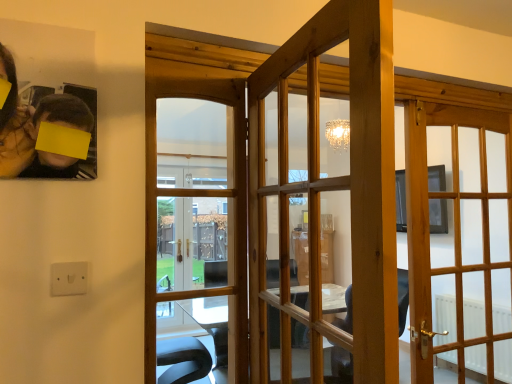
Question: Can you see light wood door at right, placed as the 1th door when sorted from back to front, touching green matte plant at upper left?

Choices:
 (A) yes
 (B) no

Answer: (B)

Question: Considering the relative sizes of light wood door at right, which is the third door in left-to-right order, and green matte plant at upper left in the image provided, is light wood door at right, which is the third door in left-to-right order, bigger than green matte plant at upper left?

Choices:
 (A) no
 (B) yes

Answer: (B)

Question: Considering the relative positions of light wood door at right, which ranks as the 3th door in front-to-back order, and green matte plant at upper left in the image provided, is light wood door at right, which ranks as the 3th door in front-to-back order, to the left of green matte plant at upper left from the viewer's perspective?

Choices:
 (A) no
 (B) yes

Answer: (A)

Question: Is light wood door at right, acting as the 1th door starting from the right, not close to green matte plant at upper left?

Choices:
 (A) yes
 (B) no

Answer: (A)

Question: Considering the relative sizes of light wood door at right, placed as the 1th door when sorted from back to front, and green matte plant at upper left in the image provided, is light wood door at right, placed as the 1th door when sorted from back to front, taller than green matte plant at upper left?

Choices:
 (A) yes
 (B) no

Answer: (A)

Question: In terms of width, does wooden glass door at center, which appears as the third door when viewed from the back, look wider or thinner when compared to white plastic electric outlet at lower left?

Choices:
 (A) thin
 (B) wide

Answer: (B)

Question: In terms of height, does wooden glass door at center, acting as the second door starting from the right, look taller or shorter compared to white plastic electric outlet at lower left?

Choices:
 (A) tall
 (B) short

Answer: (A)

Question: Which is correct: wooden glass door at center, which appears as the third door when viewed from the back, is inside white plastic electric outlet at lower left, or outside of it?

Choices:
 (A) outside
 (B) inside

Answer: (A)

Question: Is point (301, 309) positioned closer to the camera than point (56, 289)?

Choices:
 (A) closer
 (B) farther

Answer: (B)

Question: Considering the positions of white plastic electric outlet at lower left and wooden glass door at center, which appears as the 3th door when viewed from the right, in the image, is white plastic electric outlet at lower left bigger or smaller than wooden glass door at center, which appears as the 3th door when viewed from the right,?

Choices:
 (A) small
 (B) big

Answer: (A)

Question: From a real-world perspective, is white plastic electric outlet at lower left above or below wooden glass door at center, the 2th door from the front?

Choices:
 (A) below
 (B) above

Answer: (A)

Question: Would you say white plastic electric outlet at lower left is to the left or to the right of wooden glass door at center, arranged as the 1th door when viewed from the left, in the picture?

Choices:
 (A) right
 (B) left

Answer: (B)

Question: Is point (61, 276) positioned closer to the camera than point (245, 284)?

Choices:
 (A) farther
 (B) closer

Answer: (B)

Question: Considering their positions, is wooden glass door at center, which appears as the third door when viewed from the back, located in front of or behind wooden glass door at center, the 2th door from the front?

Choices:
 (A) front
 (B) behind

Answer: (A)

Question: Would you say wooden glass door at center, acting as the second door starting from the right, is inside or outside wooden glass door at center, which appears as the 3th door when viewed from the right?

Choices:
 (A) outside
 (B) inside

Answer: (A)